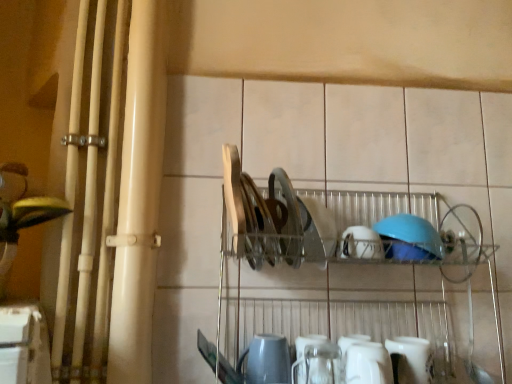
Question: In the image, is white glossy mug at lower center, the second tableware positioned from the top, on the left side or the right side of white glossy mug at lower center, which is the fourth tableware from left to right?

Choices:
 (A) left
 (B) right

Answer: (A)

Question: In terms of width, does white glossy mug at lower center, the second tableware positioned from the top, look wider or thinner when compared to white glossy mug at lower center, the first tableware in the bottom-to-top sequence?

Choices:
 (A) thin
 (B) wide

Answer: (B)

Question: Which object is positioned farthest from the white glossy mug at lower center, the second tableware positioned from the top?

Choices:
 (A) white glossy mug at lower center, the 1th tableware viewed from the right
 (B) matte gray kettle at lower center, the second tableware when ordered from bottom to top
 (C) metallic silver dish rack at center
 (D) white matte bowl at center, the second tableware when ordered from right to left

Answer: (C)

Question: Which of these objects is positioned farthest from the white glossy mug at lower center, which is the fourth tableware from top to bottom?

Choices:
 (A) metallic silver dish rack at center
 (B) white glossy mug at lower center, the second tableware positioned from the top
 (C) matte gray kettle at lower center, which is the first tableware from left to right
 (D) white matte bowl at center, the second tableware when ordered from right to left

Answer: (C)